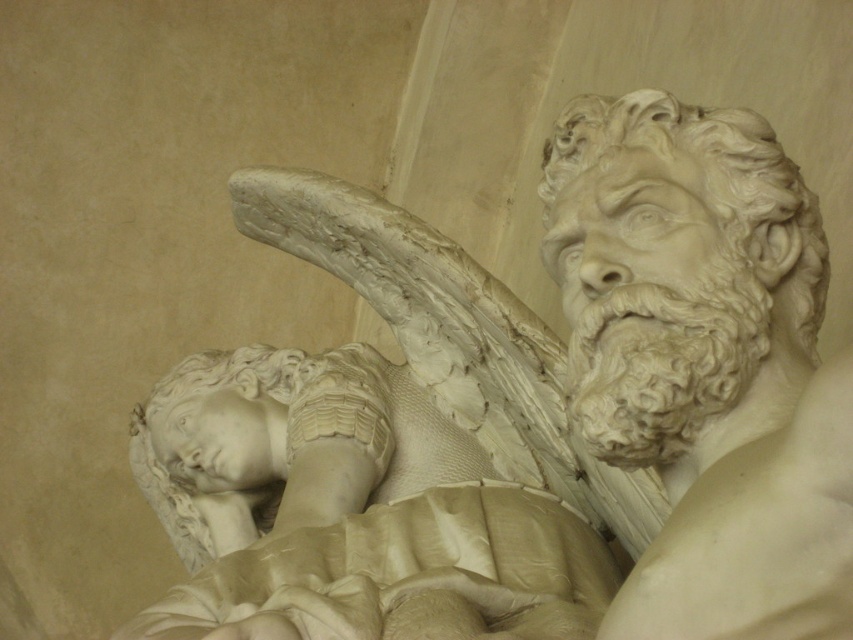
You are an art conservator examining the sculpture. You notice that the white marble head at upper right and the white marble head at lower left are positioned in a way that could affect their exposure to light. Based on their spatial arrangement, which head is more likely to cast a shadow on the other?

The white marble head at upper right is in front of the white marble head at lower left, so it is more likely to cast a shadow on the latter when light comes from behind it.

You are examining the classical sculpture and want to determine which of the two points, point (682,324) or point (160,465), is closer to your viewpoint. Based on the sculpture details, which point is nearer to you?

Point (682,324) is closer to the camera than point (160,465), so it is nearer to your viewpoint.

Based on the provided scene description, can you determine the location of the point labeled as point (689, 275)?

The point labeled (689, 275) is located on the white marble head at upper right.